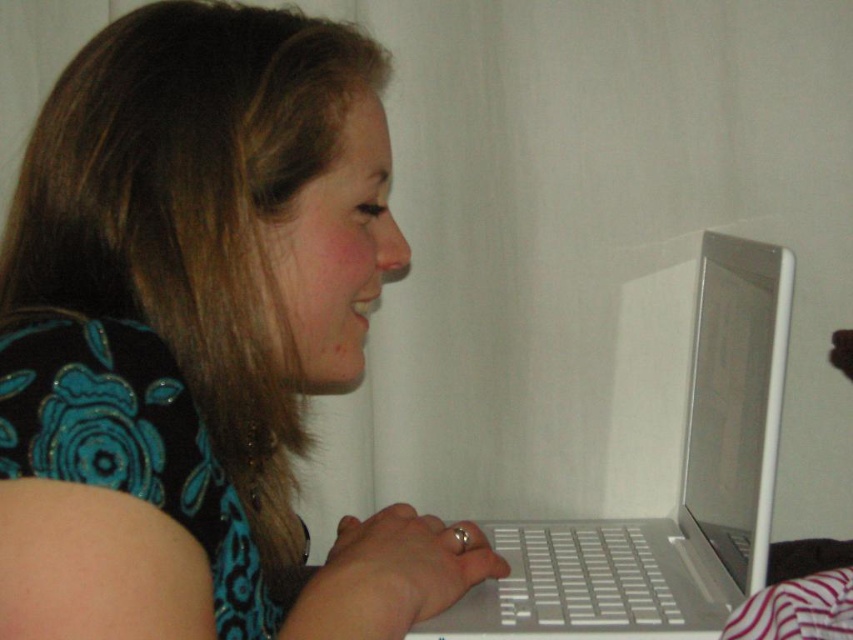
In the scene shown: Between white plastic laptop at center and white glossy laptop at center, which one has less height?

white glossy laptop at center is shorter.

Is white plastic laptop at center above white glossy laptop at center?

Correct, white plastic laptop at center is located above white glossy laptop at center.

Is point (612, 556) behind point (825, 579)?

Yes.

Where is `white plastic laptop at center`? This screenshot has height=640, width=853. white plastic laptop at center is located at coordinates (x=662, y=468).

From the picture: Is blue floral dress at center bigger than white plastic laptop at center?

Indeed, blue floral dress at center has a larger size compared to white plastic laptop at center.

Who is more forward, (177, 465) or (663, 493)?

Point (177, 465) is more forward.

Locate an element on the screen. blue floral dress at center is located at coordinates (200, 339).

This screenshot has height=640, width=853. Describe the element at coordinates (200, 339) in the screenshot. I see `blue floral dress at center` at that location.

This screenshot has width=853, height=640. Find the location of `blue floral dress at center`. blue floral dress at center is located at coordinates (200, 339).